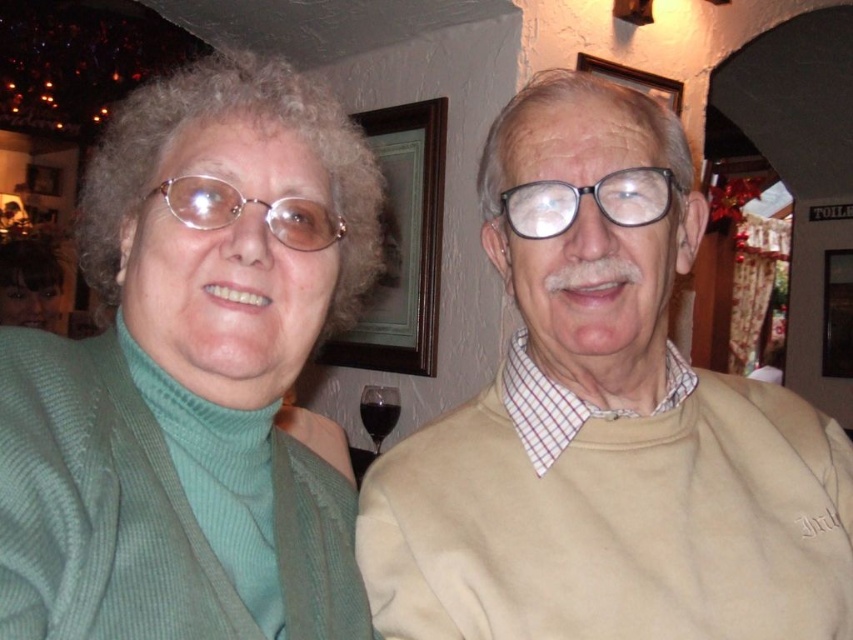
Based on the coordinates provided, can you determine the position of the green ribbed turtleneck sweater at left relative to the center of the image?

The green ribbed turtleneck sweater at left is located at coordinates point (192,376), which is slightly to the right and above the center of the image.

You are a photographer setting up for a group photo. You notice the green ribbed turtleneck sweater at left and the transparent glass at lower center in your frame. Based on their positions, which object is more likely to block the background if you focus on the foreground? Please explain your reasoning.

The green ribbed turtleneck sweater at left is more likely to block the background when focusing on the foreground because it is positioned to the left and might be wider than the transparent glass at lower center, making it physically larger in the frame and thus more obstructive.